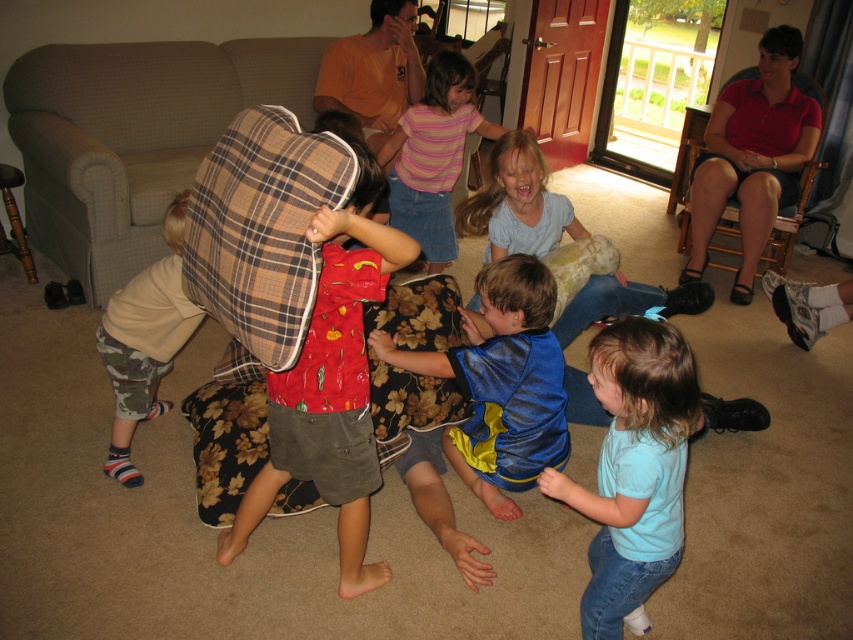
Question: Which of the following is the farthest from the observer?

Choices:
 (A) blue shiny shirt at center
 (B) striped cotton shirt at center

Answer: (B)

Question: Is light blue t-shirt at lower right behind striped cotton shirt at center?

Choices:
 (A) yes
 (B) no

Answer: (B)

Question: Where is blue shiny shirt at center located in relation to dark red fabric chair at upper right in the image?

Choices:
 (A) left
 (B) right

Answer: (A)

Question: Which point is closer to the camera taking this photo?

Choices:
 (A) (552, 476)
 (B) (352, 330)

Answer: (A)

Question: Does blue shiny shirt at center have a lesser width compared to dark red fabric chair at upper right?

Choices:
 (A) no
 (B) yes

Answer: (B)

Question: Considering the real-world distances, which object is farthest from the dark red fabric chair at upper right?

Choices:
 (A) blue shiny shirt at center
 (B) matte plaid pillow at center
 (C) light blue t-shirt at lower right
 (D) striped cotton shirt at center

Answer: (B)